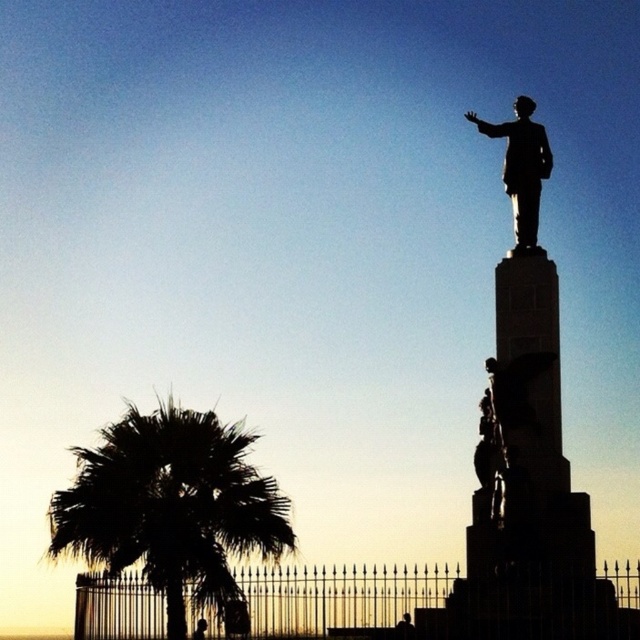
Is the position of black leafy palm tree at lower left less distant than that of polished bronze statue at upper right?

Yes, black leafy palm tree at lower left is in front of polished bronze statue at upper right.

In order to click on black leafy palm tree at lower left in this screenshot , I will do `click(170, 506)`.

You are a GUI agent. You are given a task and a screenshot of the screen. Output one action in this format:
    pyautogui.click(x=<x>, y=<y>)
    Task: Click on the black leafy palm tree at lower left
    This screenshot has height=640, width=640.
    Given the screenshot: What is the action you would take?
    pyautogui.click(x=170, y=506)